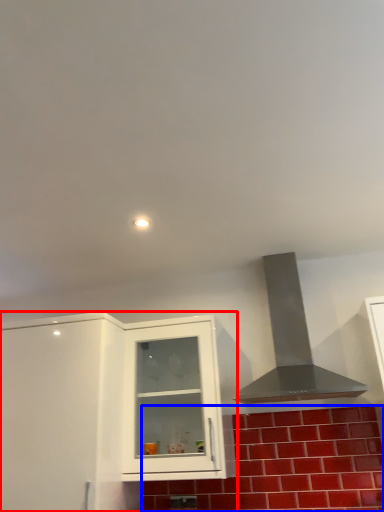
Question: Among these objects, which one is farthest to the camera, cabinetry (highlighted by a red box) or brick (highlighted by a blue box)?

Choices:
 (A) cabinetry
 (B) brick

Answer: (B)